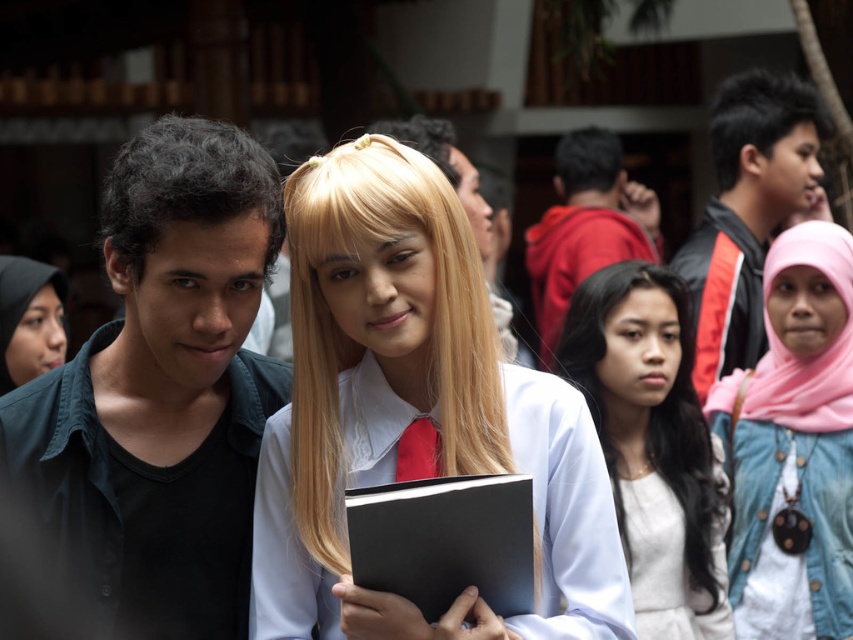
Is smooth white blouse at center further to the viewer compared to matte black shirt at center?

No, smooth white blouse at center is in front of matte black shirt at center.

Is smooth white blouse at center thinner than matte black shirt at center?

No.

At what (x,y) coordinates should I click in order to perform the action: click on smooth white blouse at center. Please return your answer as a coordinate pair (x, y). Looking at the image, I should click on (413, 413).

Between dark brown hair at upper right and matte black shirt at center, which one is positioned higher?

dark brown hair at upper right is higher up.

Based on the photo, can you confirm if dark brown hair at upper right is shorter than matte black shirt at center?

Indeed, dark brown hair at upper right has a lesser height compared to matte black shirt at center.

Which is in front, point (775, 134) or point (376, 125)?

Point (775, 134) is more forward.

In order to click on dark brown hair at upper right in this screenshot , I will do `click(759, 116)`.

Is dark brown hair at upper right shorter than red satin tie at center?

In fact, dark brown hair at upper right may be taller than red satin tie at center.

Is dark brown hair at upper right to the right of red satin tie at center from the viewer's perspective?

Yes, dark brown hair at upper right is to the right of red satin tie at center.

Is point (764, 106) more distant than point (395, 474)?

Yes, point (764, 106) is behind point (395, 474).

In order to click on dark brown hair at upper right in this screenshot , I will do `click(759, 116)`.